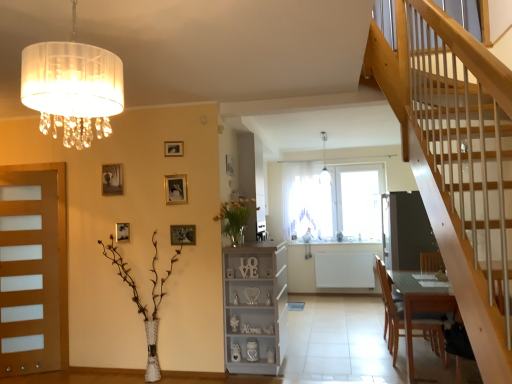
Question: From the image's perspective, relative to wooden picture frame at upper center, the 6th picture frame positioned from the left, is white glass pendant light at upper center above or below?

Choices:
 (A) above
 (B) below

Answer: (A)

Question: Would you say white glass pendant light at upper center is inside or outside wooden picture frame at upper center, the 6th picture frame positioned from the front?

Choices:
 (A) outside
 (B) inside

Answer: (A)

Question: Which of these objects is positioned closest to the transparent glass window at center?

Choices:
 (A) yellow matte vase at center, the first floral arrangement in the right-to-left sequence
 (B) wooden picture frame at upper left, which is the third picture frame from back to front
 (C) matte gold picture frame at upper left, the second picture frame positioned from the back
 (D) wooden picture frame at upper center, which is the 3th picture frame in left-to-right order
 (E) metallic gold picture frame at upper center, the fifth picture frame positioned from the left

Answer: (A)

Question: Estimate the real-world distances between objects in this image. Which object is farther from the wooden picture frame at upper center, which is the 3th picture frame from front to back?

Choices:
 (A) transparent glass window at center
 (B) brown wooden chair at lower right
 (C) dark gray matte screen door at center
 (D) white sheer curtain at center
 (E) yellow matte vase at center, which is counted as the second floral arrangement, starting from the bottom

Answer: (C)